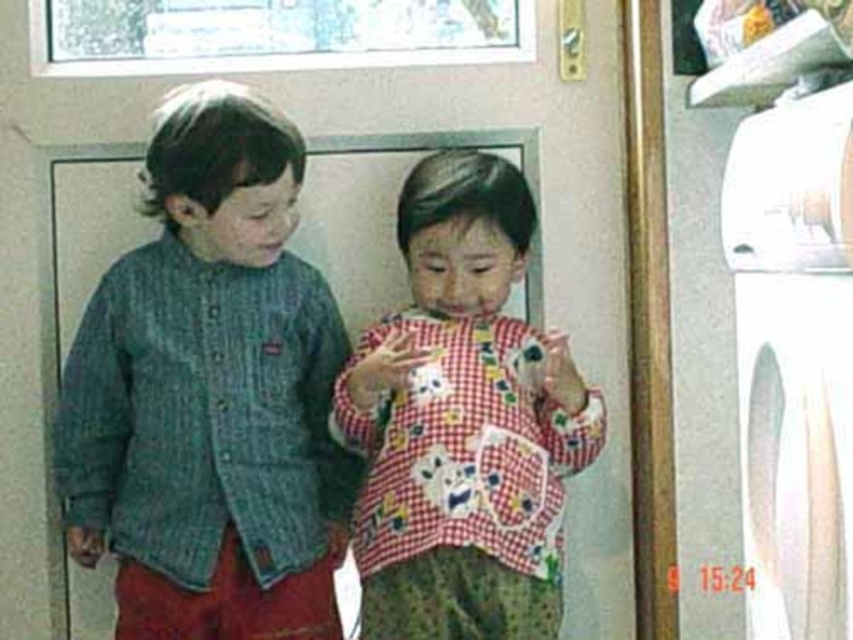
Which is more to the right, red checkered shirt at center or white plastic washing machine at right?

Positioned to the right is white plastic washing machine at right.

Between red checkered shirt at center and white plastic washing machine at right, which one is positioned lower?

red checkered shirt at center

Identify the location of red checkered shirt at center. (463, 422).

Which of these two, green textured sweater at left or red checkered shirt at center, stands taller?

Standing taller between the two is green textured sweater at left.

Does point (56, 412) come farther from viewer compared to point (335, 408)?

Yes.

Locate an element on the screen. green textured sweater at left is located at coordinates (210, 394).

Can you confirm if green textured sweater at left is wider than white plastic washing machine at right?

Indeed, green textured sweater at left has a greater width compared to white plastic washing machine at right.

Is green textured sweater at left bigger than white plastic washing machine at right?

Indeed, green textured sweater at left has a larger size compared to white plastic washing machine at right.

I want to click on green textured sweater at left, so click(x=210, y=394).